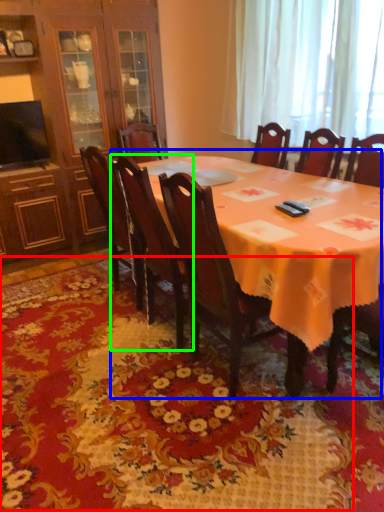
Question: Which object is positioned closest to mat (highlighted by a red box)? Select from kitchen & dining room table (highlighted by a blue box) and chair (highlighted by a green box).

Choices:
 (A) kitchen & dining room table
 (B) chair

Answer: (B)